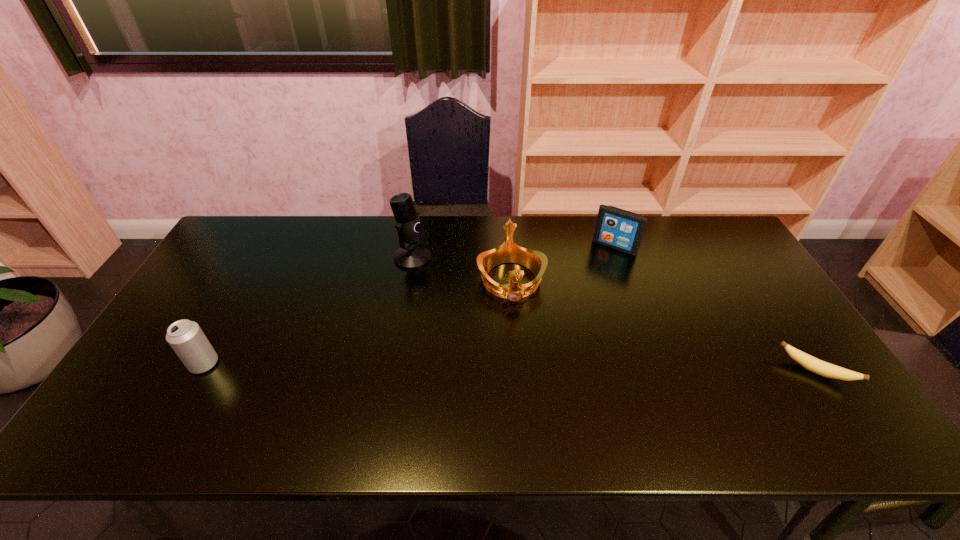
The width and height of the screenshot is (960, 540). Find the location of `vacant point located at the front emblem of the tiara`. vacant point located at the front emblem of the tiara is located at coordinates (517, 336).

Identify the location of vacant region located at the front emblem of the tiara. The height and width of the screenshot is (540, 960). (517, 339).

This screenshot has width=960, height=540. Find the location of `vacant space located 0.090m on the stand of the microphone`. vacant space located 0.090m on the stand of the microphone is located at coordinates (443, 280).

The height and width of the screenshot is (540, 960). I want to click on vacant space situated on the stand of the microphone, so click(434, 274).

Identify the location of free region located on the stand of the microphone. (447, 283).

The width and height of the screenshot is (960, 540). I want to click on free space located 0.340m on the front screen of the iPod, so click(564, 321).

Locate an element on the screen. This screenshot has width=960, height=540. free space located on the front screen of the iPod is located at coordinates (589, 281).

The image size is (960, 540). I want to click on vacant space located on the front screen of the iPod, so click(x=594, y=274).

Where is `tiara positioned at the far edge`? The height and width of the screenshot is (540, 960). tiara positioned at the far edge is located at coordinates (509, 251).

I want to click on microphone positioned at the far edge, so click(410, 230).